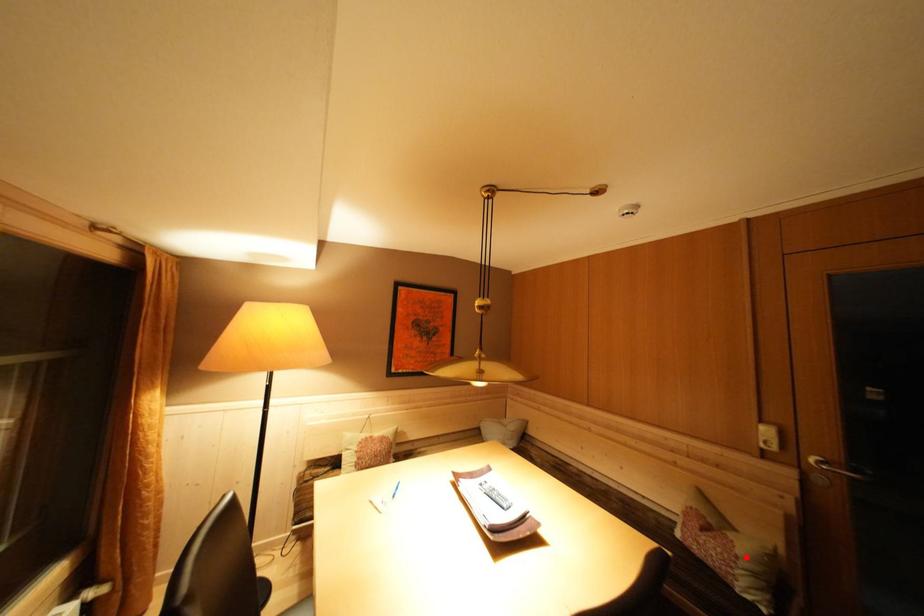
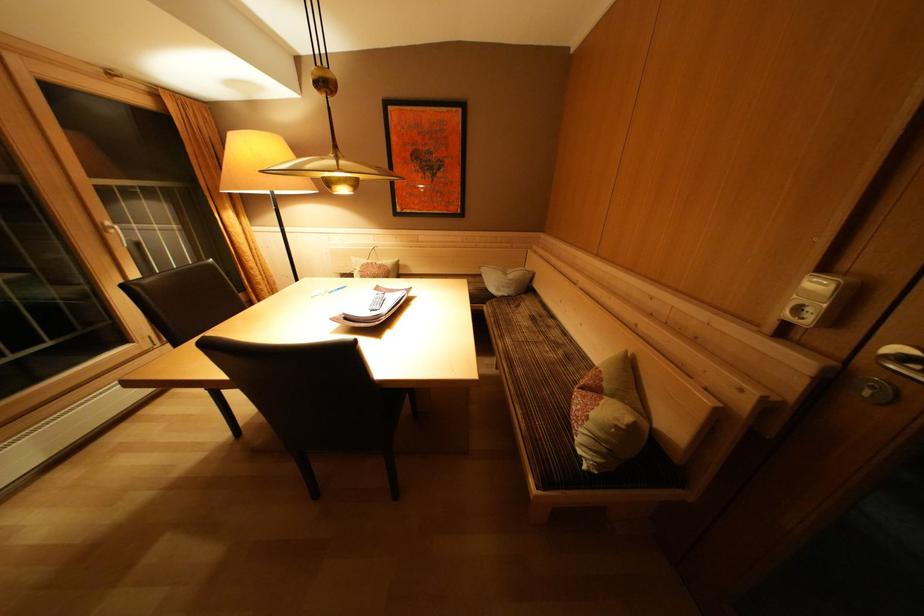
Question: A red point is marked in image1. In image2, is the corresponding 3D point closer to the camera or farther? Reply with the corresponding letter.

Choices:
 (A) The corresponding 3D point is closer.
 (B) The corresponding 3D point is farther.

Answer: (B)